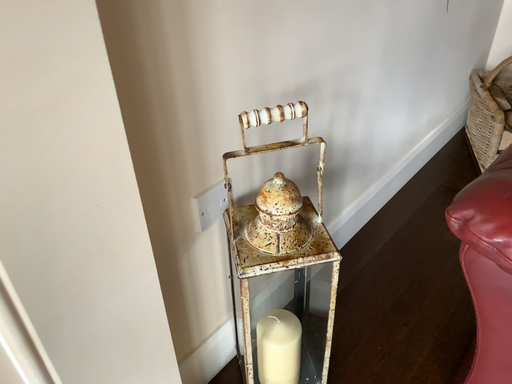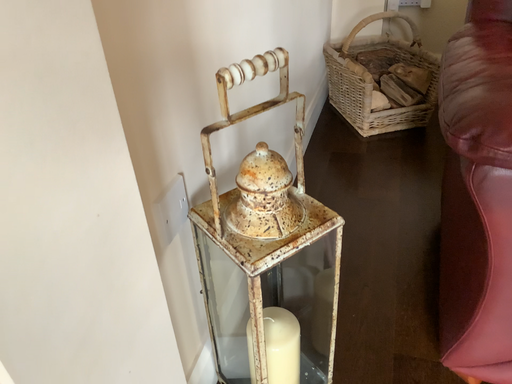
Question: How did the camera likely rotate when shooting the video?

Choices:
 (A) rotated right
 (B) rotated left

Answer: (A)